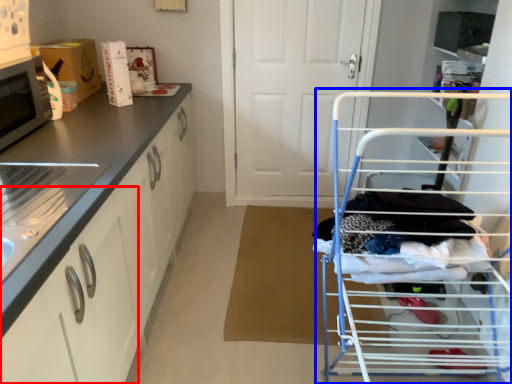
Question: Which object appears farthest to the camera in this image, drawer (highlighted by a red box) or baby carriage (highlighted by a blue box)?

Choices:
 (A) drawer
 (B) baby carriage

Answer: (A)